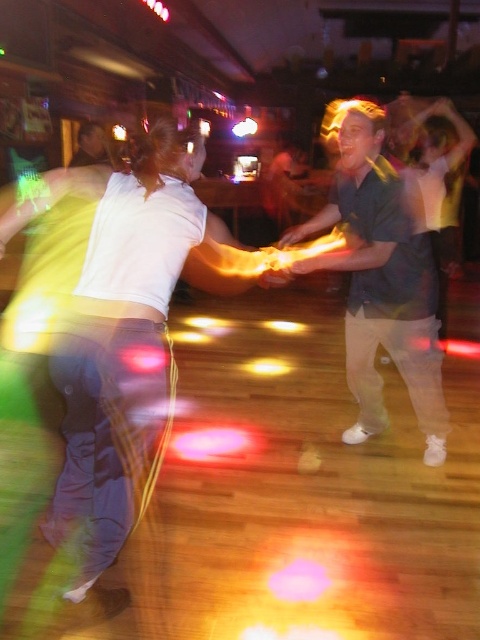
Question: Which point is farther to the camera?

Choices:
 (A) white matte pants at center
 (B) dark green shirt at center

Answer: (B)

Question: Does white matte pants at center have a smaller size compared to dark green shirt at center?

Choices:
 (A) yes
 (B) no

Answer: (A)

Question: Can you confirm if white matte pants at center is bigger than dark green shirt at center?

Choices:
 (A) no
 (B) yes

Answer: (A)

Question: Among these points, which one is farthest from the camera?

Choices:
 (A) tap(384, 301)
 (B) tap(43, 531)

Answer: (A)

Question: Which object is closer to the camera taking this photo?

Choices:
 (A) dark green shirt at center
 (B) white matte pants at center

Answer: (B)

Question: From the image, what is the correct spatial relationship of white matte pants at center in relation to dark green shirt at center?

Choices:
 (A) left
 (B) right

Answer: (A)